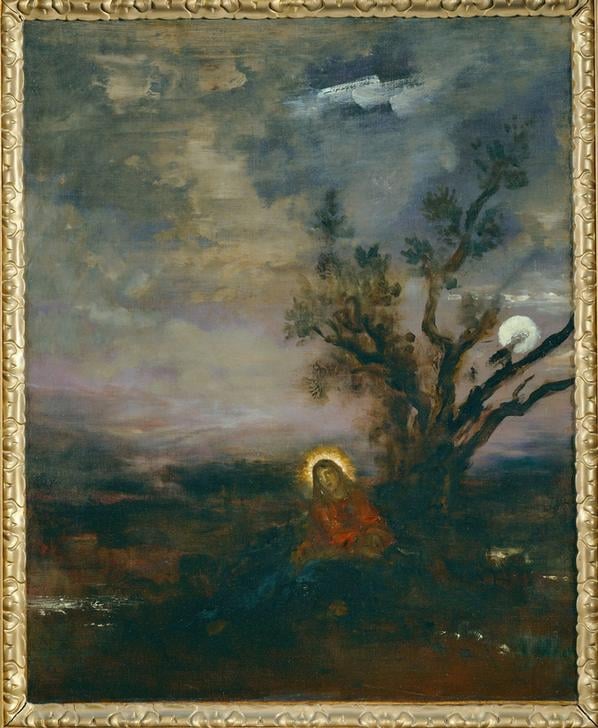
I want to click on picture frame, so click(x=363, y=716), click(x=590, y=419), click(x=12, y=399), click(x=318, y=4).